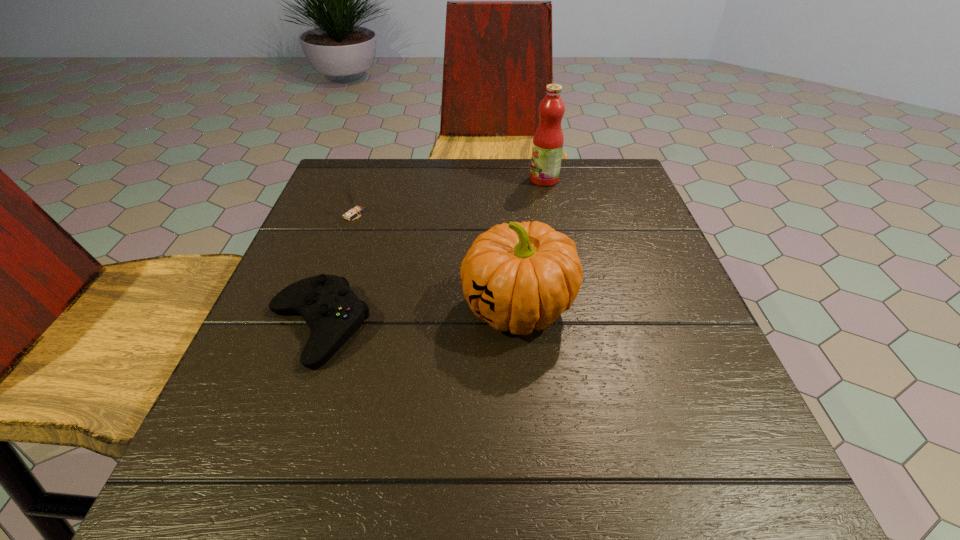
Locate an element on the screen. This screenshot has height=540, width=960. free space between the shortest object and the second tallest object is located at coordinates (418, 318).

Locate an element on the screen. unoccupied position between the pumpkin and the third nearest object is located at coordinates (436, 261).

Select which object appears as the second closest to the second tallest object. Please provide its 2D coordinates. Your answer should be formatted as a tuple, i.e. [(x, y)], where the tuple contains the x and y coordinates of a point satisfying the conditions above.

[(355, 209)]

The width and height of the screenshot is (960, 540). Identify the location of object that ranks as the second closest to the shortest object. (355, 209).

This screenshot has height=540, width=960. Find the location of `vacant space that satisfies the following two spatial constraints: 1. on the front label of the fruit juice; 2. on the front side of the shortest object`. vacant space that satisfies the following two spatial constraints: 1. on the front label of the fruit juice; 2. on the front side of the shortest object is located at coordinates (574, 327).

This screenshot has width=960, height=540. What are the coordinates of `vacant space that satisfies the following two spatial constraints: 1. on the front label of the farthest object; 2. on the front side of the third tallest object` in the screenshot? It's located at (551, 214).